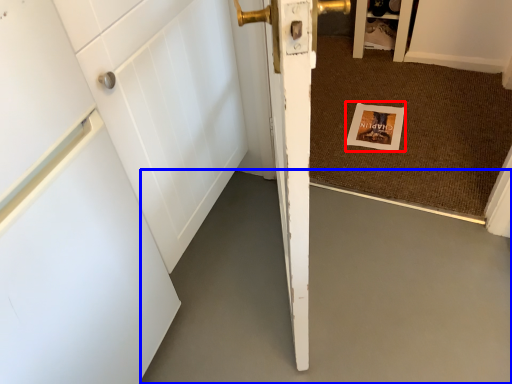
Question: Which point is further to the camera, postcard (highlighted by a red box) or concrete (highlighted by a blue box)?

Choices:
 (A) postcard
 (B) concrete

Answer: (A)